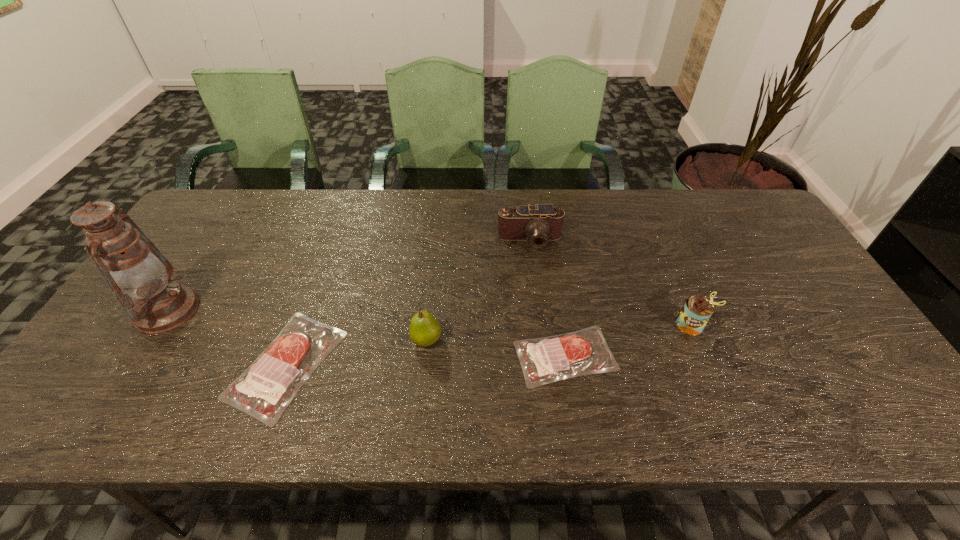
In the current image, all steaks are evenly spaced. To maintain this equal spacing, where should an additional steak be placed on the right? Please point out a free spot. Please provide its 2D coordinates. Your answer should be formatted as a tuple, i.e. [(x, y)], where the tuple contains the x and y coordinates of a point satisfying the conditions above.

[(835, 347)]